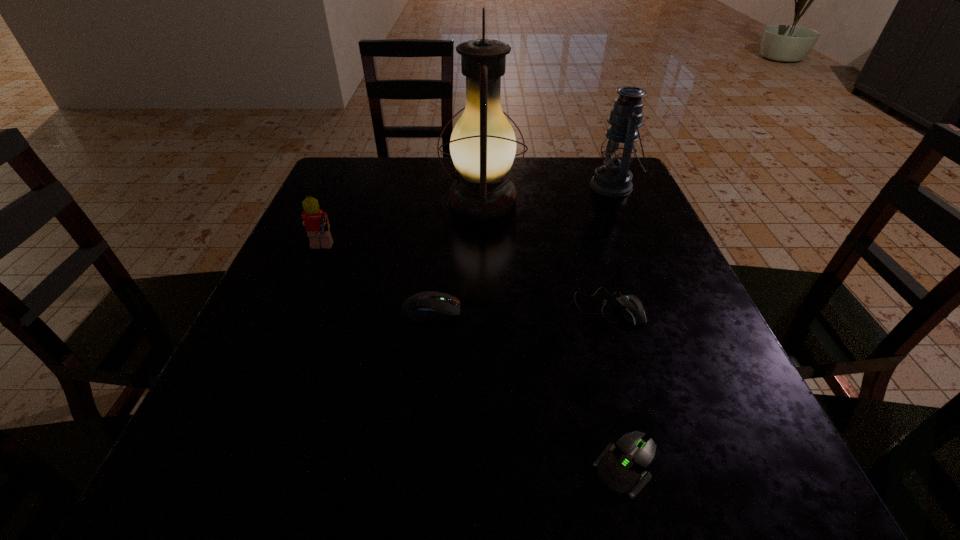
Find the location of a particular element. oil lamp is located at coordinates (483, 145).

You are a GUI agent. You are given a task and a screenshot of the screen. Output one action in this format:
    pyautogui.click(x=<x>, y=<y>)
    Task: Click on the second tallest object
    Image resolution: width=960 pixels, height=540 pixels.
    Given the screenshot: What is the action you would take?
    pyautogui.click(x=613, y=179)

Where is `Lego`? This screenshot has width=960, height=540. Lego is located at coordinates (316, 222).

At what (x,y) coordinates should I click in order to perform the action: click on the leftmost object. Please return your answer as a coordinate pair (x, y). Looking at the image, I should click on (316, 222).

The height and width of the screenshot is (540, 960). I want to click on the fourth tallest object, so click(x=429, y=305).

This screenshot has width=960, height=540. Identify the location of the tallest computer mouse. (429, 305).

At what (x,y) coordinates should I click in order to perform the action: click on the nearest object. Please return your answer as a coordinate pair (x, y). This screenshot has width=960, height=540. Looking at the image, I should click on (621, 467).

At what (x,y) coordinates should I click in order to perform the action: click on free space located on the left of the tallest object. Please return your answer as a coordinate pair (x, y). Looking at the image, I should click on [x=391, y=201].

This screenshot has height=540, width=960. I want to click on vacant space located on the front-facing side of the lantern, so click(x=518, y=186).

This screenshot has height=540, width=960. Identify the location of vacant space situated 0.340m on the front-facing side of the lantern. (455, 186).